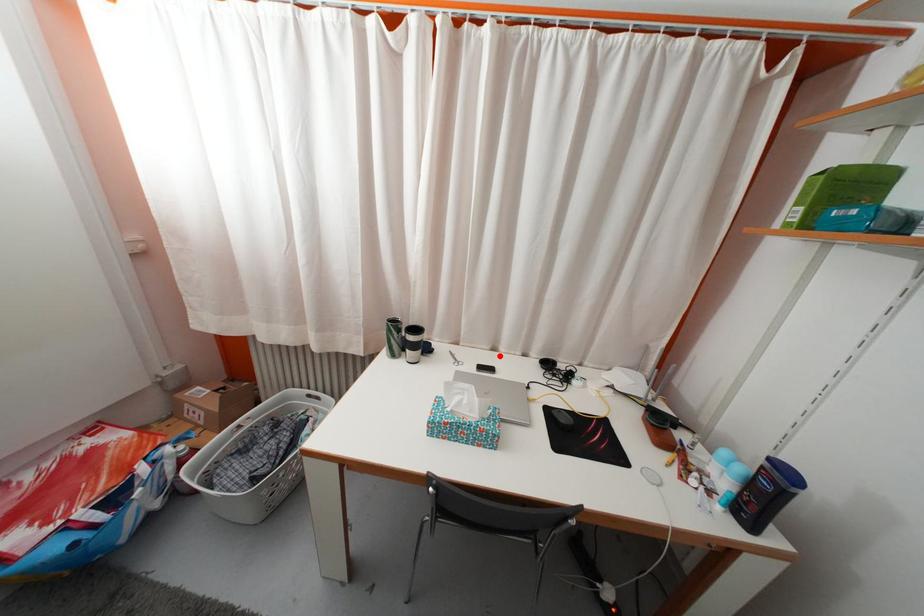
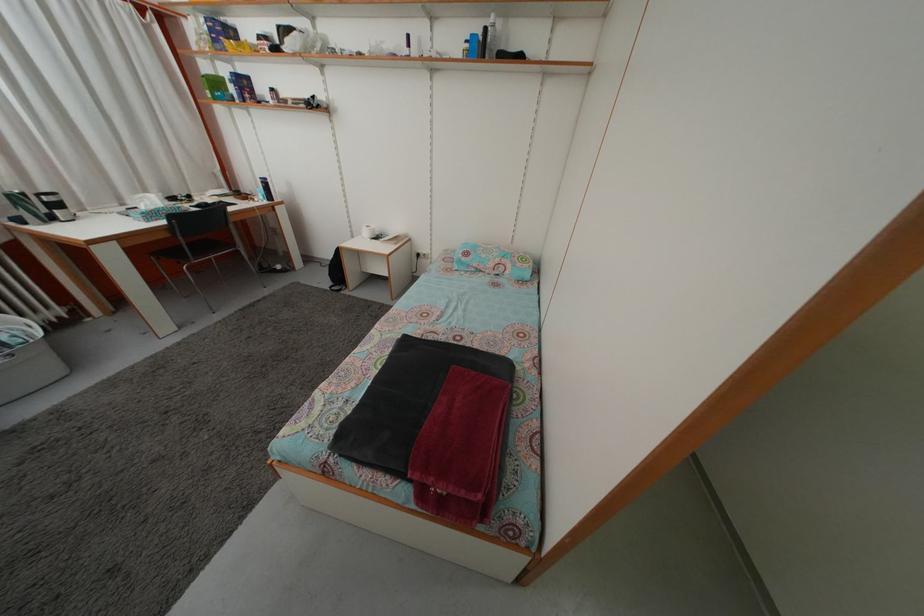
Question: I am providing you with two images of the same scene from different viewpoints. Image1 has a red point marked. In image2, the corresponding 3D location appears at what relative position? Reply with the corresponding letter.

Choices:
 (A) Closer
 (B) Farther

Answer: (B)